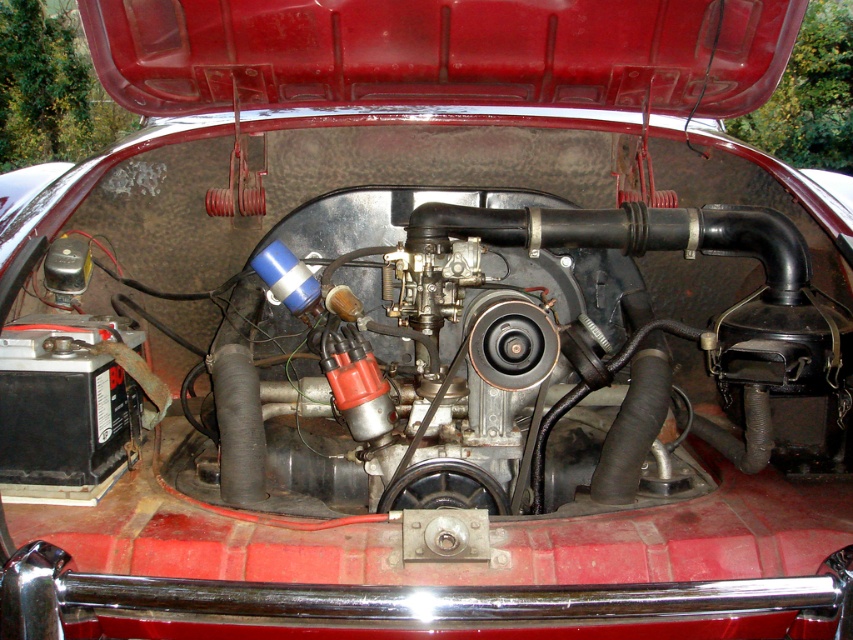
Question: Can you confirm if metallic silver engine at center is positioned to the left of smooth red hood at upper center?

Choices:
 (A) no
 (B) yes

Answer: (A)

Question: Which of the following is the farthest from the observer?

Choices:
 (A) (438, 84)
 (B) (561, 467)

Answer: (A)

Question: Considering the relative positions of metallic silver engine at center and smooth red hood at upper center in the image provided, where is metallic silver engine at center located with respect to smooth red hood at upper center?

Choices:
 (A) right
 (B) left

Answer: (A)

Question: Can you confirm if metallic silver engine at center is positioned below smooth red hood at upper center?

Choices:
 (A) no
 (B) yes

Answer: (B)

Question: Which of the following is the farthest from the observer?

Choices:
 (A) (154, 10)
 (B) (535, 330)

Answer: (A)

Question: Which point is closer to the camera?

Choices:
 (A) smooth red hood at upper center
 (B) metallic silver engine at center

Answer: (B)